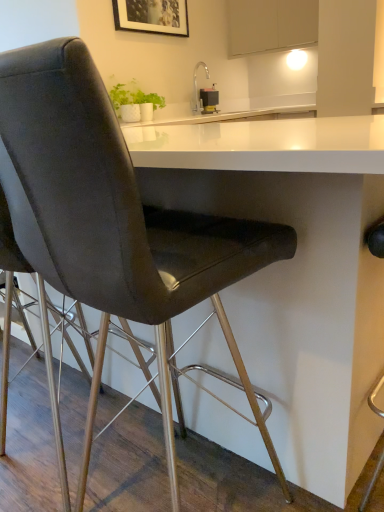
Question: From a real-world perspective, is metallic rectangular device at upper center positioned over white matte cabinet at upper center based on gravity?

Choices:
 (A) no
 (B) yes

Answer: (A)

Question: Is metallic rectangular device at upper center thinner than white matte cabinet at upper center?

Choices:
 (A) yes
 (B) no

Answer: (A)

Question: Is metallic rectangular device at upper center completely or partially outside of white matte cabinet at upper center?

Choices:
 (A) no
 (B) yes

Answer: (B)

Question: Does metallic rectangular device at upper center appear on the left side of white matte cabinet at upper center?

Choices:
 (A) yes
 (B) no

Answer: (A)

Question: Considering the relative sizes of metallic rectangular device at upper center and white matte cabinet at upper center in the image provided, is metallic rectangular device at upper center taller than white matte cabinet at upper center?

Choices:
 (A) yes
 (B) no

Answer: (B)

Question: From a real-world perspective, is metallic rectangular device at upper center located beneath white matte cabinet at upper center?

Choices:
 (A) no
 (B) yes

Answer: (B)

Question: From the image's perspective, is matte black chair at left under white glossy table at center?

Choices:
 (A) yes
 (B) no

Answer: (A)

Question: Considering the relative sizes of matte black chair at left and white glossy table at center in the image provided, is matte black chair at left taller than white glossy table at center?

Choices:
 (A) yes
 (B) no

Answer: (A)

Question: Is matte black chair at left turned away from white glossy table at center?

Choices:
 (A) yes
 (B) no

Answer: (A)

Question: Does matte black chair at left lie behind white glossy table at center?

Choices:
 (A) no
 (B) yes

Answer: (A)

Question: Does matte black chair at left have a smaller size compared to white glossy table at center?

Choices:
 (A) yes
 (B) no

Answer: (A)

Question: Can you see matte black chair at left touching white glossy table at center?

Choices:
 (A) no
 (B) yes

Answer: (A)

Question: From the image's perspective, is white matte cabinet at upper center over metallic rectangular device at upper center?

Choices:
 (A) no
 (B) yes

Answer: (B)